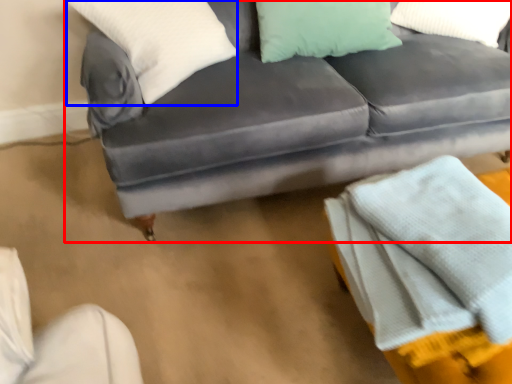
Question: Which of the following is the closest to the observer, studio couch (highlighted by a red box) or pillow (highlighted by a blue box)?

Choices:
 (A) studio couch
 (B) pillow

Answer: (A)